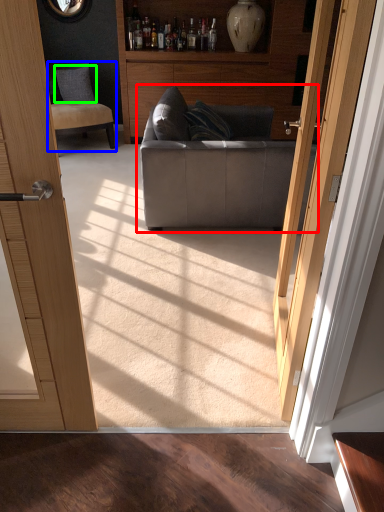
Question: Based on their relative distances, which object is nearer to studio couch (highlighted by a red box)? Choose from chair (highlighted by a blue box) and pillow (highlighted by a green box).

Choices:
 (A) chair
 (B) pillow

Answer: (A)